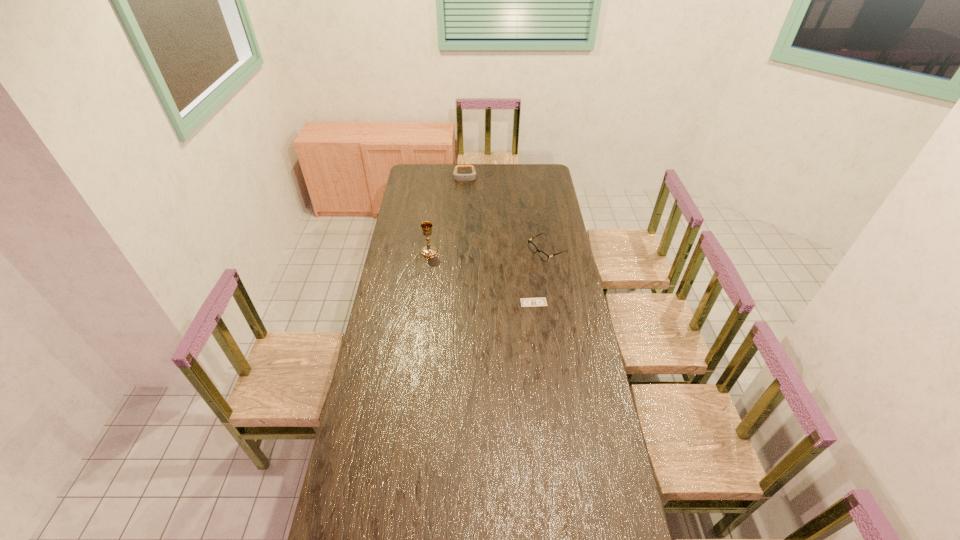
This screenshot has width=960, height=540. I want to click on the tallest object, so click(x=428, y=251).

What are the coordinates of `the leftmost object` in the screenshot? It's located at (428, 251).

Where is `money`? money is located at coordinates (525, 302).

In order to click on the nearest object in this screenshot , I will do `click(525, 302)`.

Identify the location of spectacles. (533, 248).

Locate an element on the screen. The height and width of the screenshot is (540, 960). the second object from left to right is located at coordinates (458, 177).

What are the coordinates of `goggles` in the screenshot? It's located at (458, 177).

Identify the location of vacant region located 0.060m on the right of the chalice. (450, 252).

The image size is (960, 540). Identify the location of vacant region located 0.260m on the left of the nearest object. (465, 302).

Identify the location of vacant space located 0.270m on the front-facing side of the spectacles. (490, 280).